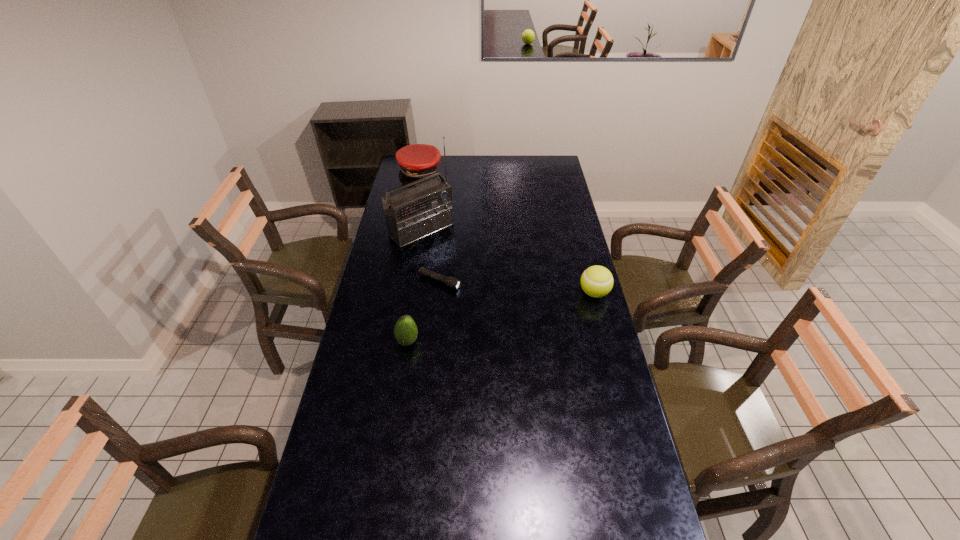
In order to click on vacant space on the desktop that is between the avocado and the tennis ball and is positioned on the front panel of the radio receiver in this screenshot , I will do `click(515, 314)`.

Where is `free space on the desktop that is between the nearest object and the tennis ball and is positioned at the lens end of the flashlight`? This screenshot has height=540, width=960. free space on the desktop that is between the nearest object and the tennis ball and is positioned at the lens end of the flashlight is located at coordinates (517, 313).

Image resolution: width=960 pixels, height=540 pixels. I want to click on vacant space on the desktop that is between the nearest object and the rightmost object and is positioned at the front of the cap where the visor is located, so click(x=530, y=309).